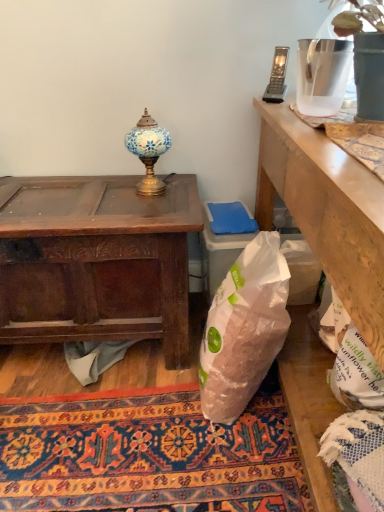
You are a GUI agent. You are given a task and a screenshot of the screen. Output one action in this format:
    pyautogui.click(x=<x>, y=<y>)
    Task: Click on the free space to the left of gray fabric at lower center
    Image resolution: width=384 pixels, height=512 pixels.
    Given the screenshot: What is the action you would take?
    pyautogui.click(x=34, y=377)